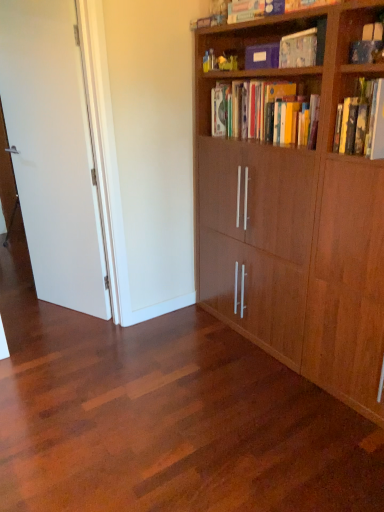
Question: From a real-world perspective, is matte blue book at upper center, which ranks as the first book in top-to-bottom order, physically located above or below wooden bookcase at right?

Choices:
 (A) below
 (B) above

Answer: (B)

Question: In the image, is matte blue book at upper center, which ranks as the first book in top-to-bottom order, on the left side or the right side of wooden bookcase at right?

Choices:
 (A) right
 (B) left

Answer: (B)

Question: Estimate the real-world distances between objects in this image. Which object is closer to the matte blue book at upper center, arranged as the third book when ordered from the bottom?

Choices:
 (A) shiny wood floor at center
 (B) white matte door at left
 (C) wooden bookcase at right
 (D) hardcover books at upper center, which is the 1th book in bottom-to-top order
 (E) matte cardboard book at upper center, which is the second book in top-to-bottom order

Answer: (E)

Question: Which object is positioned farthest from the hardcover books at upper center, which is the 3th book from top to bottom?

Choices:
 (A) matte blue book at upper center, which ranks as the first book in top-to-bottom order
 (B) white matte door at left
 (C) wooden bookcase at right
 (D) shiny wood floor at center
 (E) matte cardboard book at upper center, which appears as the 2th book when ordered from the bottom

Answer: (D)